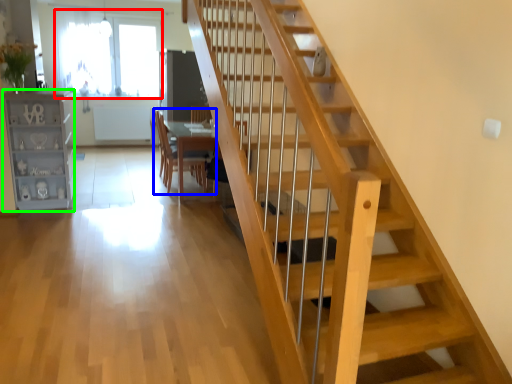
Question: Which object is positioned farthest from window (highlighted by a red box)? Select from chair (highlighted by a blue box) and bookshelf (highlighted by a green box).

Choices:
 (A) chair
 (B) bookshelf

Answer: (B)